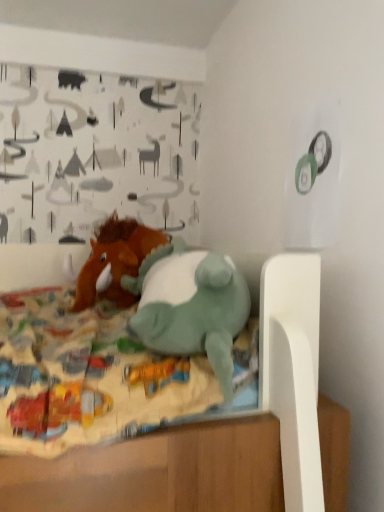
Question: Relative to fuzzy brown stuffed horse at center, the second toy from the front, is teal plush dinosaur at center, the second toy positioned from the back, in front or behind?

Choices:
 (A) behind
 (B) front

Answer: (B)

Question: Considering the positions of teal plush dinosaur at center, the first toy viewed from the front, and fuzzy brown stuffed horse at center, which is counted as the 1th toy, starting from the back, in the image, is teal plush dinosaur at center, the first toy viewed from the front, bigger or smaller than fuzzy brown stuffed horse at center, which is counted as the 1th toy, starting from the back,?

Choices:
 (A) small
 (B) big

Answer: (B)

Question: Considering the positions of teal plush dinosaur at center, the second toy positioned from the back, and fuzzy brown stuffed horse at center, the second toy from the front, in the image, is teal plush dinosaur at center, the second toy positioned from the back, wider or thinner than fuzzy brown stuffed horse at center, the second toy from the front,?

Choices:
 (A) thin
 (B) wide

Answer: (A)

Question: Do you think fuzzy brown stuffed horse at center, which is counted as the 1th toy, starting from the back, is within teal plush dinosaur at center, the second toy positioned from the back, or outside of it?

Choices:
 (A) outside
 (B) inside

Answer: (A)

Question: From the image's perspective, is fuzzy brown stuffed horse at center, the second toy from the front, above or below teal plush dinosaur at center, the second toy positioned from the back?

Choices:
 (A) below
 (B) above

Answer: (B)

Question: From a real-world perspective, relative to teal plush dinosaur at center, the second toy positioned from the back, is fuzzy brown stuffed horse at center, the second toy from the front, vertically above or below?

Choices:
 (A) above
 (B) below

Answer: (A)

Question: Is fuzzy brown stuffed horse at center, the second toy from the front, wider or thinner than teal plush dinosaur at center, the first toy viewed from the front?

Choices:
 (A) thin
 (B) wide

Answer: (B)